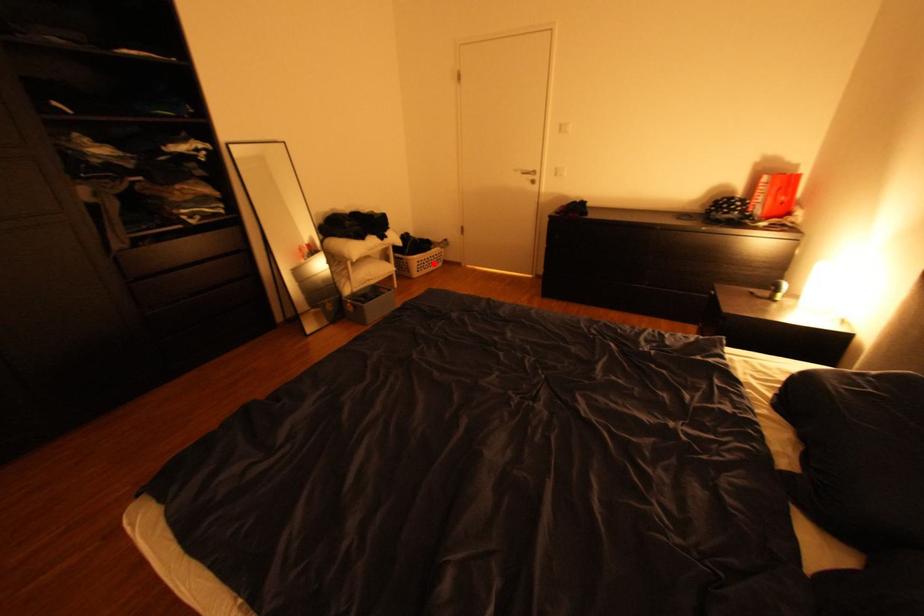
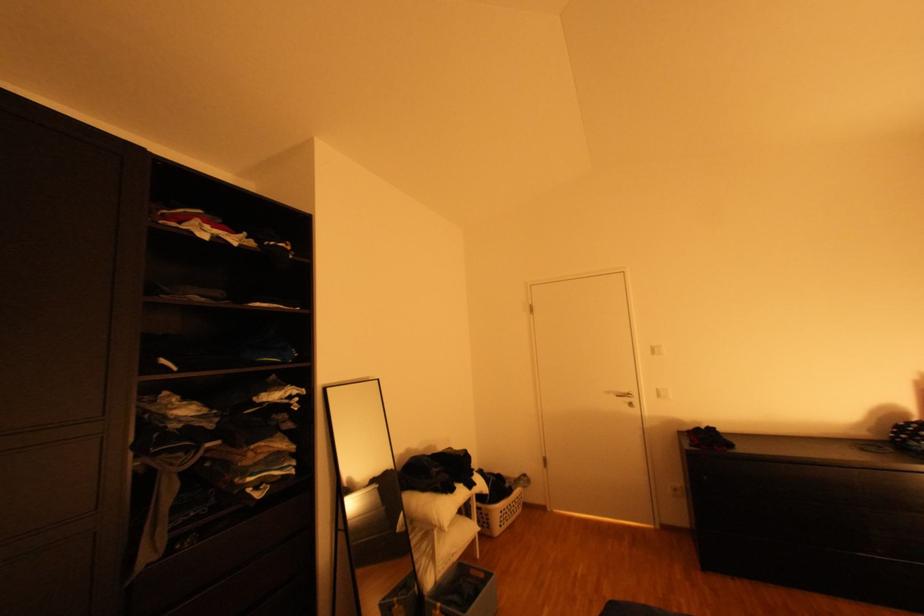
Question: A red point is marked in image1. In image2, is the corresponding 3D point closer to the camera or farther? Reply with the corresponding letter.

Choices:
 (A) The corresponding 3D point is closer.
 (B) The corresponding 3D point is farther.

Answer: (B)